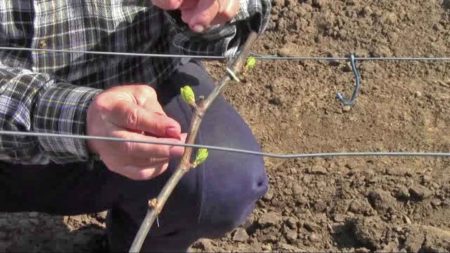
I want to click on metal hook, so click(350, 97).